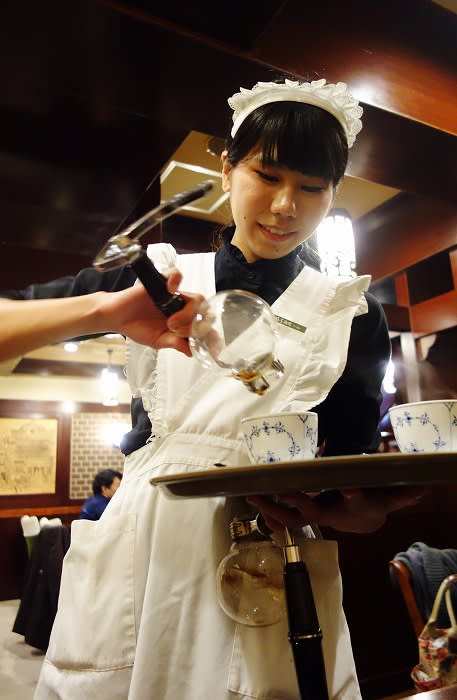
This screenshot has height=700, width=457. I want to click on ceiling, so click(x=401, y=164).